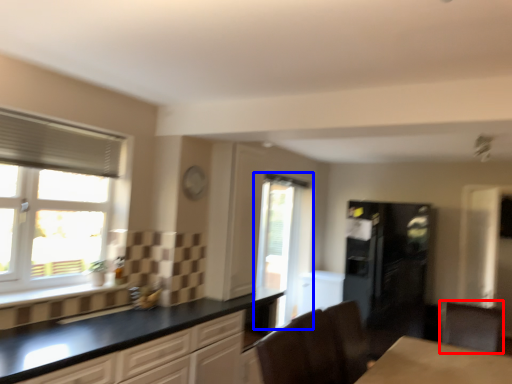
Question: Which object is closer to the camera taking this photo, cabinetry (highlighted by a red box) or window (highlighted by a blue box)?

Choices:
 (A) cabinetry
 (B) window

Answer: (A)